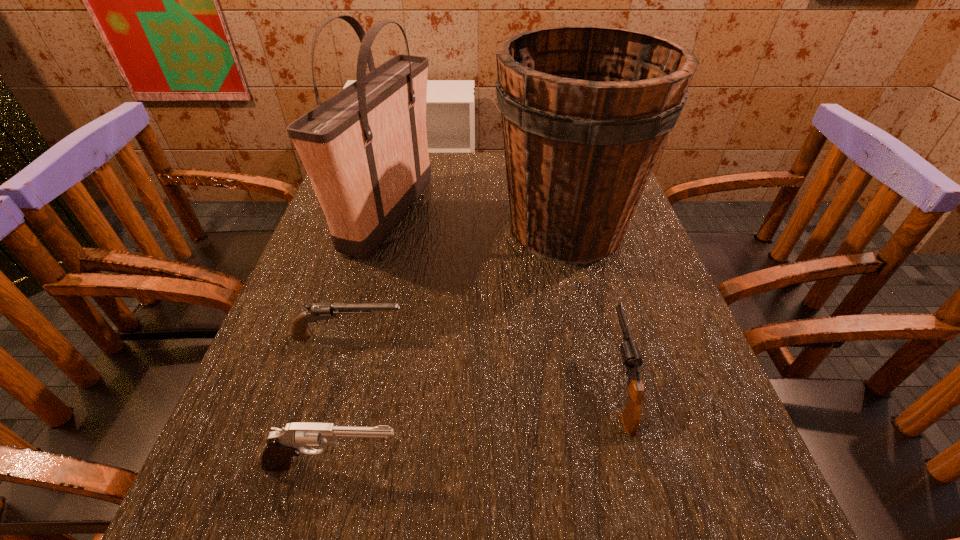
Find the location of a particular element. This screenshot has height=540, width=960. object situated at the far right corner is located at coordinates (586, 110).

In the image, there is a desktop. In order to click on free space at the far edge in this screenshot , I will do `click(480, 153)`.

Where is `blank space at the near edge`? This screenshot has width=960, height=540. blank space at the near edge is located at coordinates (364, 528).

Locate an element on the screen. The image size is (960, 540). free space at the left edge of the desktop is located at coordinates (321, 300).

In the image, there is a desktop. Find the location of `vacant space at the right edge`. vacant space at the right edge is located at coordinates click(x=620, y=281).

This screenshot has height=540, width=960. I want to click on free space between the nearest gun and the second nearest gun, so click(x=476, y=426).

This screenshot has height=540, width=960. In order to click on vacant space in between the shortest object and the shopping bag in this screenshot , I will do `click(369, 276)`.

Identify the location of vacant area between the second nearest gun and the shopping bag. Image resolution: width=960 pixels, height=540 pixels. (504, 301).

Locate an element on the screen. vacant area between the shopping bag and the shortest gun is located at coordinates (369, 276).

Where is `free point between the third farthest object and the shopping bag`? free point between the third farthest object and the shopping bag is located at coordinates (369, 276).